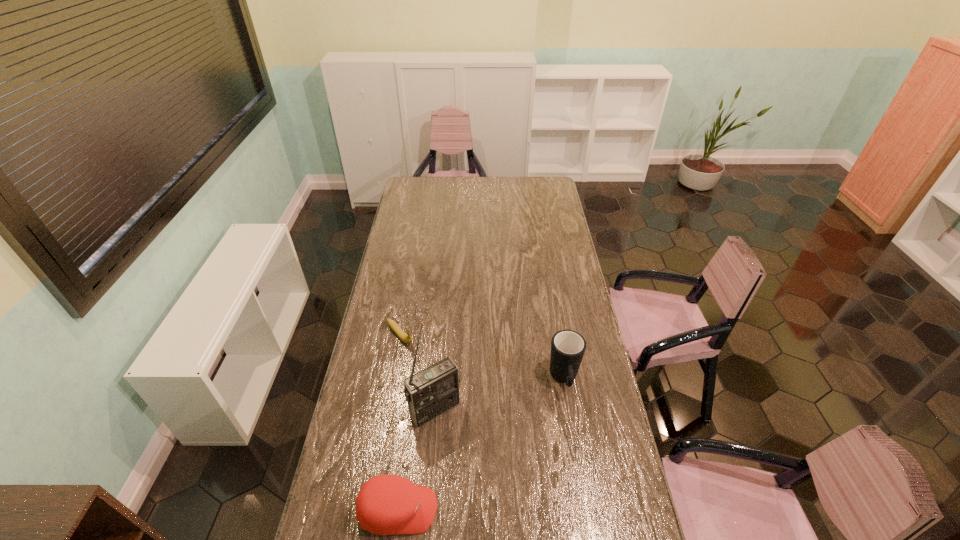
I want to click on free space between the banana and the cap, so click(399, 422).

Find the location of `vacant space that is in between the rightmost object and the radio receiver`. vacant space that is in between the rightmost object and the radio receiver is located at coordinates (500, 394).

The width and height of the screenshot is (960, 540). In order to click on free point between the tallest object and the farthest object in this screenshot , I will do `click(418, 372)`.

The width and height of the screenshot is (960, 540). I want to click on free point between the nearest object and the mug, so click(x=481, y=444).

Where is `object that is the third closest to the third shortest object`? The height and width of the screenshot is (540, 960). object that is the third closest to the third shortest object is located at coordinates (407, 339).

You are a GUI agent. You are given a task and a screenshot of the screen. Output one action in this format:
    pyautogui.click(x=<x>, y=<y>)
    Task: Click on the object that is the second closest to the banana
    The width and height of the screenshot is (960, 540).
    Given the screenshot: What is the action you would take?
    pyautogui.click(x=568, y=347)